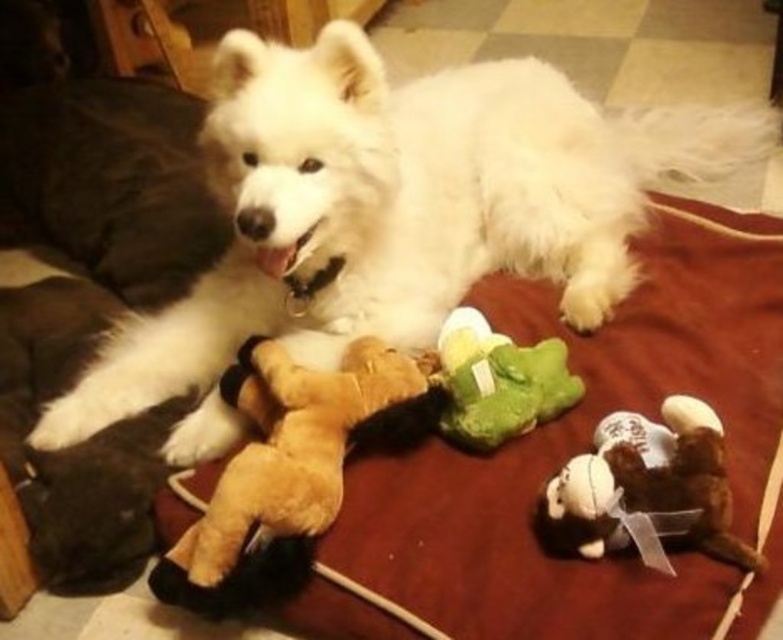
Can you confirm if brown plush bear at lower left is positioned to the left of green plush frog at center?

Yes, brown plush bear at lower left is to the left of green plush frog at center.

Who is positioned more to the left, brown plush bear at lower left or green plush frog at center?

brown plush bear at lower left

Which is behind, point (240, 532) or point (507, 422)?

The point (507, 422) is more distant.

Locate an element on the screen. This screenshot has width=783, height=640. brown plush bear at lower left is located at coordinates (291, 467).

Between white fluffy dog at upper center and green plush frog at center, which one appears on the right side from the viewer's perspective?

From the viewer's perspective, green plush frog at center appears more on the right side.

Which is in front, point (181, 355) or point (462, 362)?

Positioned in front is point (462, 362).

Find the location of `white fluffy dog at upper center`. white fluffy dog at upper center is located at coordinates (392, 212).

Is brown plush bear at lower right above green plush frog at center?

Incorrect, brown plush bear at lower right is not positioned above green plush frog at center.

Who is more distant from viewer, (560, 472) or (540, 419)?

The point (540, 419) is more distant.

Measure the distance between brown plush bear at lower right and camera.

brown plush bear at lower right is 3.49 feet from camera.

Where is `brown plush bear at lower right`? This screenshot has height=640, width=783. brown plush bear at lower right is located at coordinates (646, 490).